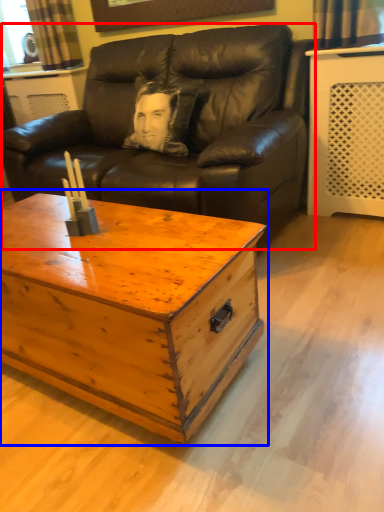
Question: Among these objects, which one is farthest to the camera, studio couch (highlighted by a red box) or coffee table (highlighted by a blue box)?

Choices:
 (A) studio couch
 (B) coffee table

Answer: (A)